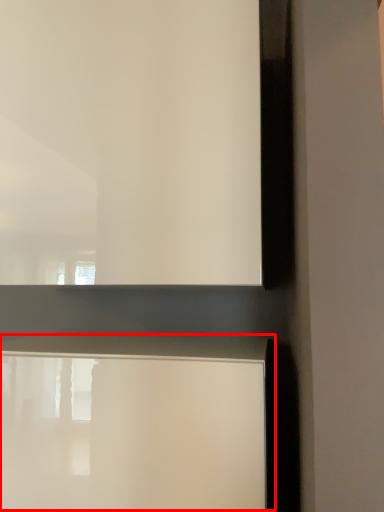
Question: Observing the image, what is the correct spatial positioning of table (annotated by the red box) in reference to window frame?

Choices:
 (A) left
 (B) right

Answer: (A)